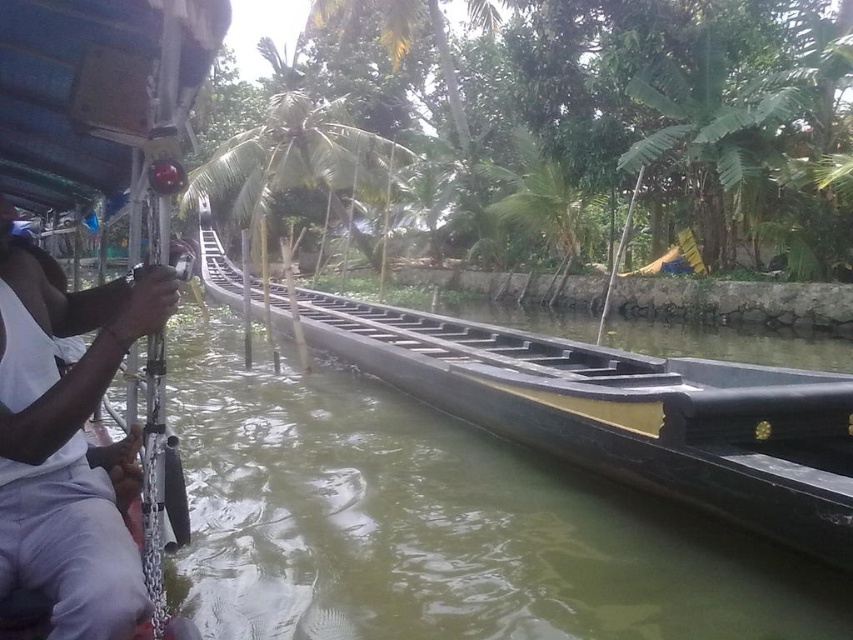
Who is more forward, (654, 436) or (80, 564)?

Positioned in front is point (80, 564).

Which is in front, point (717, 417) or point (61, 412)?

Point (61, 412)

What are the coordinates of `black matte boat at center` in the screenshot? It's located at (625, 412).